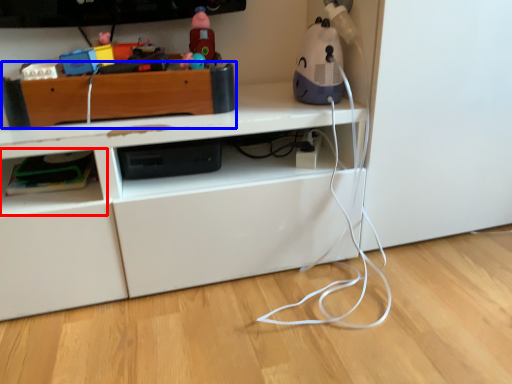
Question: Which point is further to the camera, shelf (highlighted by a red box) or shelf (highlighted by a blue box)?

Choices:
 (A) shelf
 (B) shelf

Answer: (A)